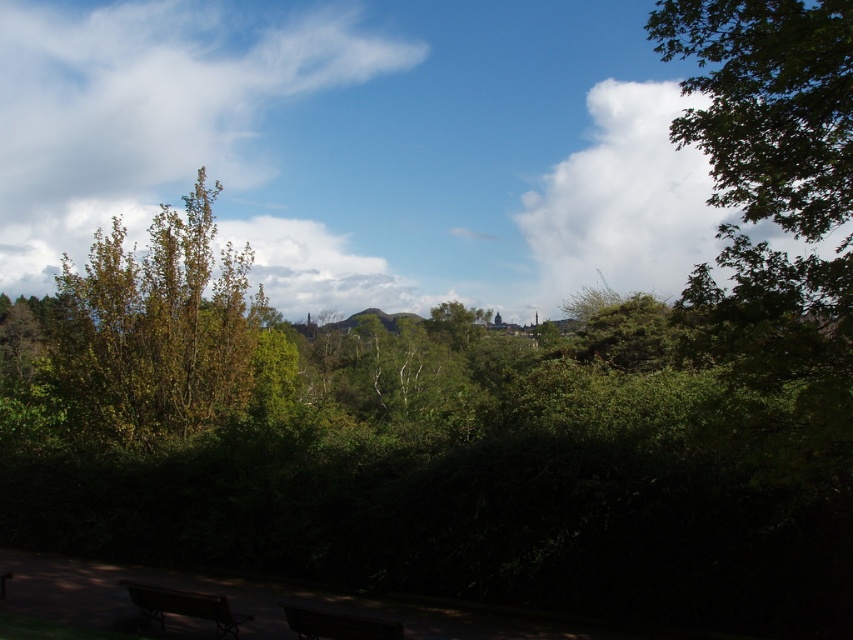
Question: Does dark brown wooden bench at lower left appear on the right side of dark brown wooden bench at lower center?

Choices:
 (A) no
 (B) yes

Answer: (A)

Question: Which point is farther to the camera?

Choices:
 (A) (202, 22)
 (B) (392, 637)

Answer: (A)

Question: Does green leafy tree at left lie behind white fluffy cloud at upper center?

Choices:
 (A) yes
 (B) no

Answer: (B)

Question: Which point is closer to the camera taking this photo?

Choices:
 (A) (160, 588)
 (B) (277, 276)
 (C) (303, 609)
 (D) (91, 378)

Answer: (C)

Question: Can you confirm if white fluffy cloud at upper left is wider than green leafy tree at left?

Choices:
 (A) no
 (B) yes

Answer: (B)

Question: Which object appears closest to the camera in this image?

Choices:
 (A) white fluffy cloud at upper right
 (B) white fluffy cloud at upper center
 (C) dark brown wooden bench at lower center
 (D) white fluffy cloud at upper left

Answer: (C)